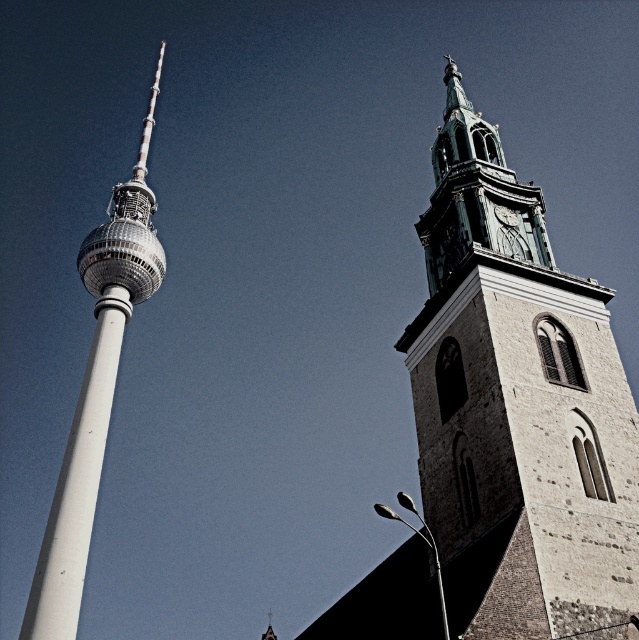
What do you see at coordinates (520, 397) in the screenshot? The image size is (639, 640). I see `stone tower at right` at bounding box center [520, 397].

Locate an element on the screen. The image size is (639, 640). stone tower at right is located at coordinates (520, 397).